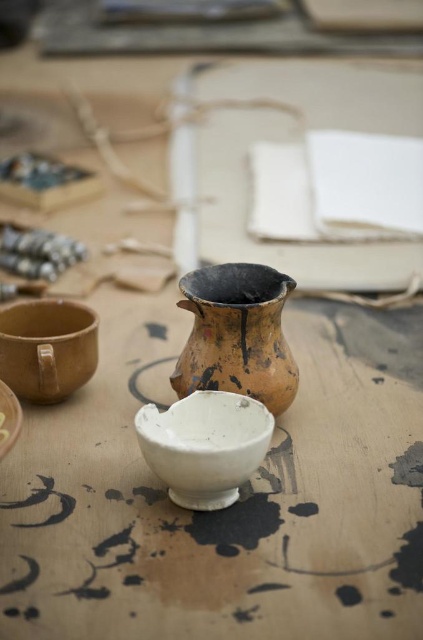
Between point (186, 371) and point (14, 326), which one is positioned in front?

Point (186, 371)

Identify the location of brown earthenware jug at center. This screenshot has width=423, height=640. coord(236,333).

You are a GUI agent. You are given a task and a screenshot of the screen. Output one action in this format:
    pyautogui.click(x=<x>, y=<y>)
    Task: Click on the brown earthenware jug at center
    
    Given the screenshot: What is the action you would take?
    [x=236, y=333]

Where is `brown earthenware jug at center`? Image resolution: width=423 pixels, height=640 pixels. brown earthenware jug at center is located at coordinates (236, 333).

Which is more to the right, matte brown bowl at lower left or white matte bowl at center?

From the viewer's perspective, matte brown bowl at lower left appears more on the right side.

Measure the distance from matte brown bowl at lower left to white matte bowl at center.

matte brown bowl at lower left and white matte bowl at center are 6.85 inches apart from each other.

Find the location of a particular element. The width and height of the screenshot is (423, 640). matte brown bowl at lower left is located at coordinates (46, 348).

Find the location of a particular element. The height and width of the screenshot is (640, 423). matte brown bowl at lower left is located at coordinates (46, 348).

Can you confirm if brown earthenware jug at center is shorter than white matte bowl at center?

No.

Is point (271, 387) farther from viewer compared to point (0, 458)?

That is True.

Identify the location of brown earthenware jug at center. (236, 333).